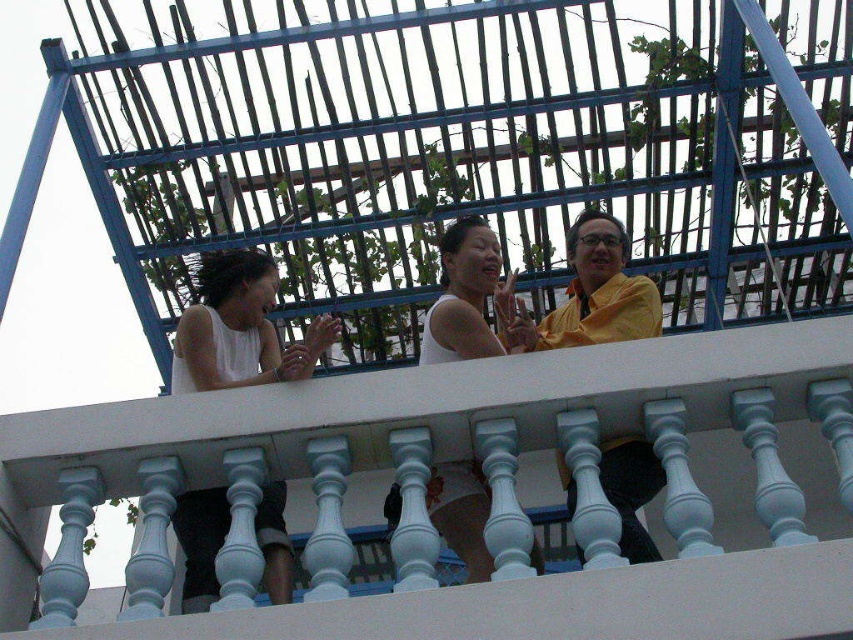
You are a fashion designer observing the two people on the balcony. You need to determine which clothing item has a greater horizontal span. Which one is wider between the white matte tank top at upper left and the yellow matte shirt at center?

The white matte tank top at upper left has a greater width than the yellow matte shirt at center, as stated in the description that the white matte tank top at upper left surpasses the yellow matte shirt at center in width.

You are standing on the balcony and want to place a small potted plant at the point marked by coordinates point [592,294]. According to the scene description, where exactly would this potted plant be placed?

The point [592,294] is located on the yellow matte shirt at center, so placing the potted plant there would position it directly on the yellow matte shirt at center.

You are a photographer standing on the balcony and want to take a photo of the yellow matte shirt at center and the white matte tank top at center. Which one should you focus on first if you want to capture the taller object?

The white matte tank top at center is taller than the yellow matte shirt at center, so you should focus on the white matte tank top at center first to capture the taller object.